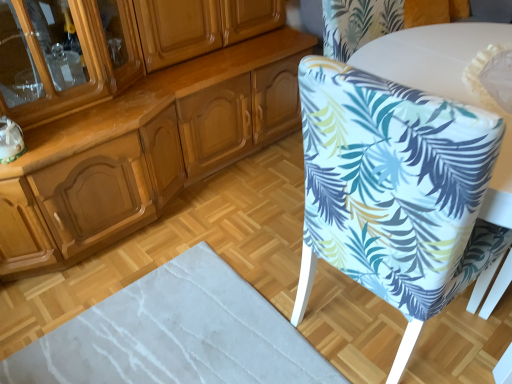
The height and width of the screenshot is (384, 512). Describe the element at coordinates (394, 191) in the screenshot. I see `white fabric-covered chair at right` at that location.

Where is `transparent glass cabinet at upper left`? This screenshot has width=512, height=384. transparent glass cabinet at upper left is located at coordinates (47, 62).

Considering the relative sizes of white glossy round table at upper right and white fabric-covered chair at right in the image provided, is white glossy round table at upper right thinner than white fabric-covered chair at right?

No.

From the image's perspective, who appears lower, white glossy round table at upper right or white fabric-covered chair at right?

white fabric-covered chair at right.

In the scene shown: Is white glossy round table at upper right not close to white fabric-covered chair at right?

No, white glossy round table at upper right is not far from white fabric-covered chair at right.

How much distance is there between white glossy round table at upper right and white fabric-covered chair at right?

white glossy round table at upper right is 23.58 inches away from white fabric-covered chair at right.

Considering the relative sizes of white fabric-covered chair at right and transparent glass cabinet at upper left in the image provided, is white fabric-covered chair at right shorter than transparent glass cabinet at upper left?

Incorrect, the height of white fabric-covered chair at right does not fall short of that of transparent glass cabinet at upper left.

From a real-world perspective, which is physically below, white fabric-covered chair at right or transparent glass cabinet at upper left?

white fabric-covered chair at right is physically lower.

Identify the location of chair on the right of transparent glass cabinet at upper left. (394, 191).

How many degrees apart are the facing directions of white fabric-covered chair at right and transparent glass cabinet at upper left?

94.9 degrees.

Locate an element on the screen. The width and height of the screenshot is (512, 384). chair beneath the transparent glass cabinet at upper left (from a real-world perspective) is located at coordinates (394, 191).

How many degrees apart are the facing directions of transparent glass cabinet at upper left and white fabric-covered chair at right?

94.9 degrees.

From the image's perspective, is transparent glass cabinet at upper left beneath white fabric-covered chair at right?

Actually, transparent glass cabinet at upper left appears above white fabric-covered chair at right in the image.

Which object is positioned more to the right, transparent glass cabinet at upper left or white fabric-covered chair at right?

Positioned to the right is white fabric-covered chair at right.

Considering the relative sizes of white glossy round table at upper right and transparent glass cabinet at upper left in the image provided, is white glossy round table at upper right thinner than transparent glass cabinet at upper left?

No.

Is white glossy round table at upper right shorter than transparent glass cabinet at upper left?

No.

Considering the positions of objects white glossy round table at upper right and transparent glass cabinet at upper left in the image provided, who is more to the left, white glossy round table at upper right or transparent glass cabinet at upper left?

transparent glass cabinet at upper left is more to the left.

Does white glossy round table at upper right touch transparent glass cabinet at upper left?

No, white glossy round table at upper right is not making contact with transparent glass cabinet at upper left.

Is transparent glass cabinet at upper left spatially inside white glossy round table at upper right, or outside of it?

The correct answer is: outside.

Could you tell me if transparent glass cabinet at upper left is facing white glossy round table at upper right?

No, transparent glass cabinet at upper left is not oriented towards white glossy round table at upper right.

Does point (98, 51) appear closer or farther from the camera than point (415, 81)?

Point (98, 51) appears to be farther away from the viewer than point (415, 81).

Which object is thinner, white fabric-covered chair at right or white glossy round table at upper right?

white fabric-covered chair at right is thinner.

Is white fabric-covered chair at right not near white glossy round table at upper right?

No.

Does point (390, 172) come behind point (441, 85)?

No, it is not.

Is white fabric-covered chair at right spatially inside white glossy round table at upper right, or outside of it?

white fabric-covered chair at right is not enclosed by white glossy round table at upper right.

Where is `round table that appears behind the white fabric-covered chair at right`? round table that appears behind the white fabric-covered chair at right is located at coordinates coord(431,56).

The width and height of the screenshot is (512, 384). What are the coordinates of `chair on the right side of transparent glass cabinet at upper left` in the screenshot? It's located at tap(394, 191).

Looking at the image, which one is located closer to white glossy round table at upper right, white fabric-covered chair at right or transparent glass cabinet at upper left?

Among the two, white fabric-covered chair at right is located nearer to white glossy round table at upper right.

Looking at the image, which one is located further to white glossy round table at upper right, transparent glass cabinet at upper left or white fabric-covered chair at right?

transparent glass cabinet at upper left.

Considering their positions, is transparent glass cabinet at upper left positioned further to white fabric-covered chair at right than white glossy round table at upper right?

transparent glass cabinet at upper left lies further to white fabric-covered chair at right than the other object.

Looking at this image, which object lies nearer to the anchor point white fabric-covered chair at right, white glossy round table at upper right or transparent glass cabinet at upper left?

Based on the image, white glossy round table at upper right appears to be nearer to white fabric-covered chair at right.

Considering their positions, is white fabric-covered chair at right positioned closer to transparent glass cabinet at upper left than white glossy round table at upper right?

white fabric-covered chair at right is positioned closer to the anchor transparent glass cabinet at upper left.

Considering their positions, is white glossy round table at upper right positioned further to transparent glass cabinet at upper left than white fabric-covered chair at right?

The object further to transparent glass cabinet at upper left is white glossy round table at upper right.

Locate an element on the screen. Image resolution: width=512 pixels, height=384 pixels. chair between transparent glass cabinet at upper left and white glossy round table at upper right in the horizontal direction is located at coordinates (394, 191).